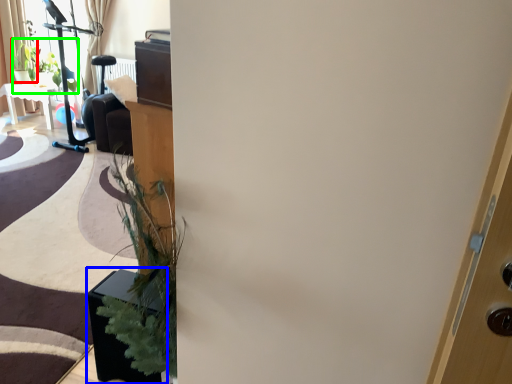
Question: Which object is the closest to the plant (highlighted by a red box)? Choose among these: furniture (highlighted by a blue box) or plant (highlighted by a green box).

Choices:
 (A) furniture
 (B) plant

Answer: (B)